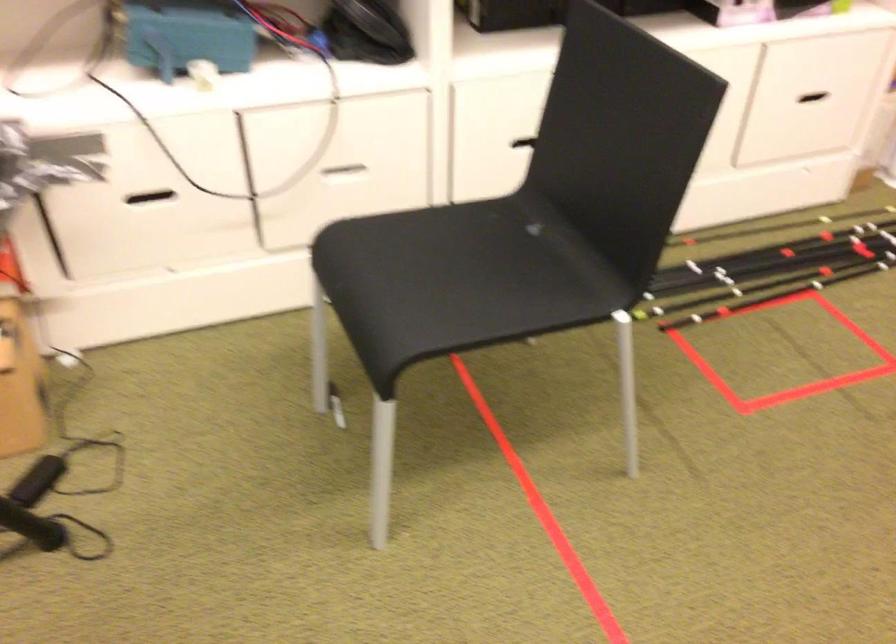
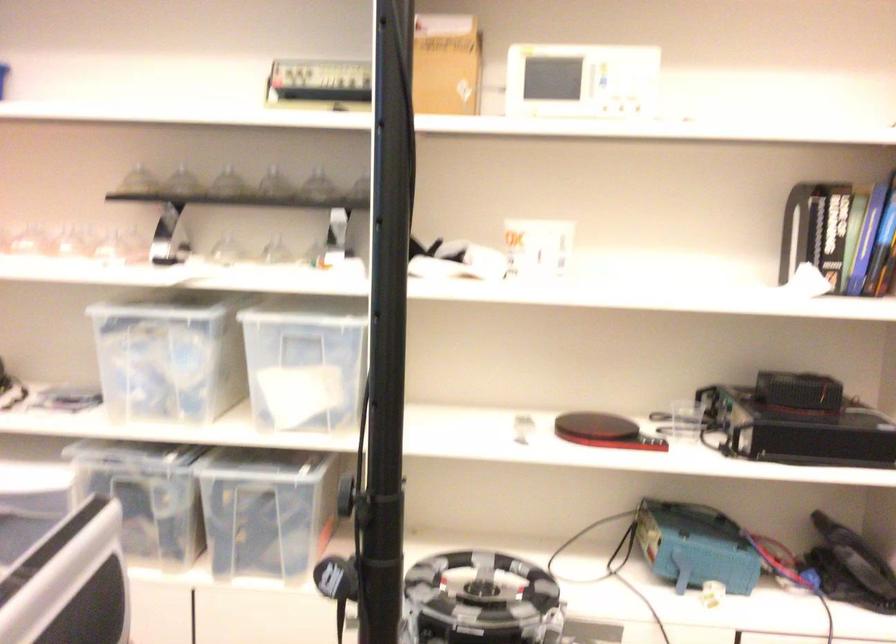
The images are taken continuously from a first-person perspective. In which direction is your viewpoint rotating?

The camera rotated toward left-up.